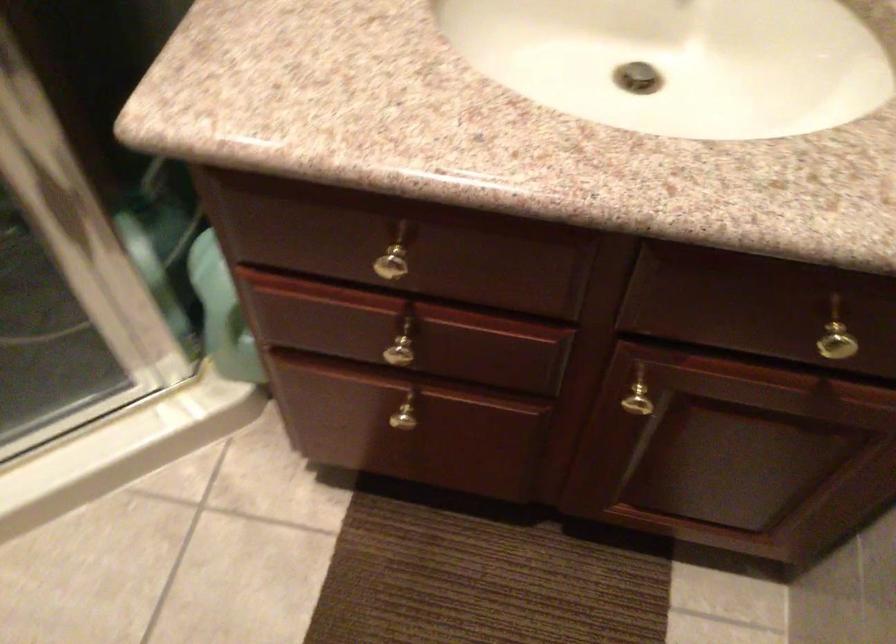
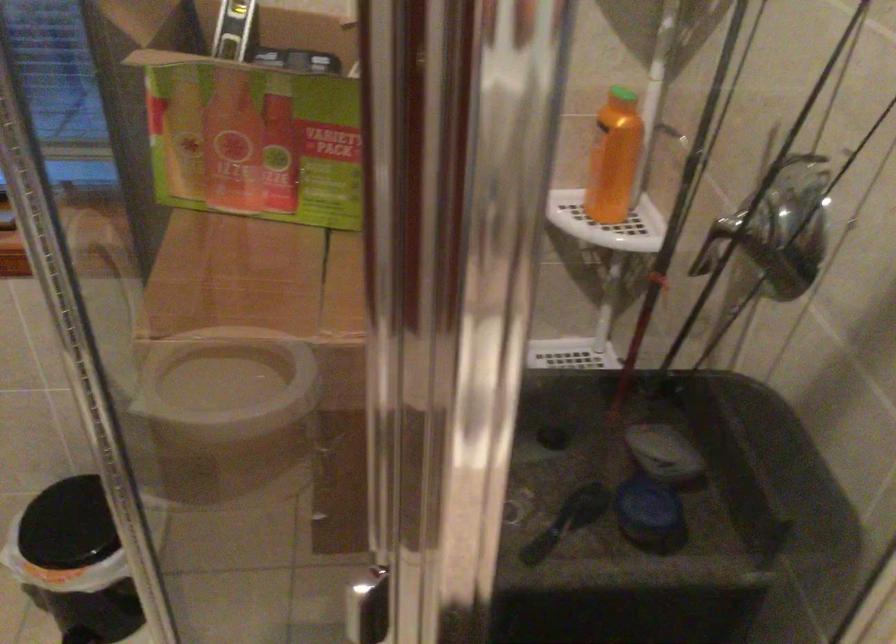
Question: How did the camera likely rotate?

Choices:
 (A) Left
 (B) Right
 (C) Up
 (D) Down

Answer: (A)